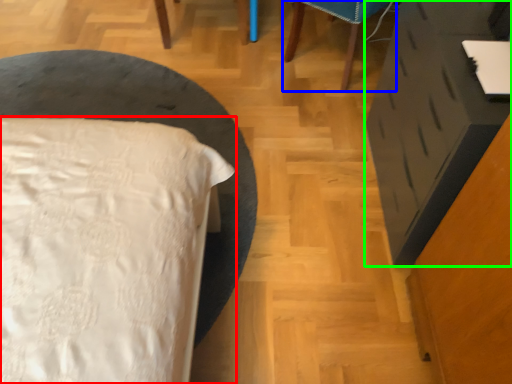
Question: Which is farther away from bed (highlighted by a red box)? furniture (highlighted by a blue box) or vanity (highlighted by a green box)?

Choices:
 (A) furniture
 (B) vanity

Answer: (A)